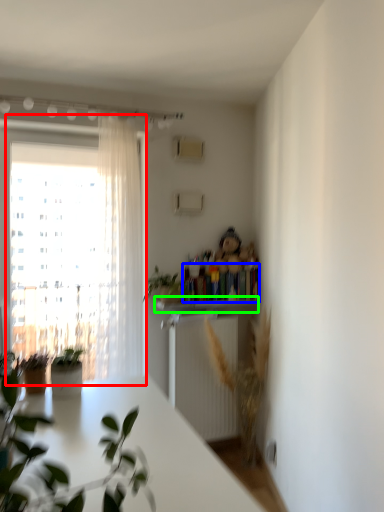
Question: Estimate the real-world distances between objects in this image. Which object is farther from window (highlighted by a red box), book (highlighted by a blue box) or window sill (highlighted by a green box)?

Choices:
 (A) book
 (B) window sill

Answer: (A)